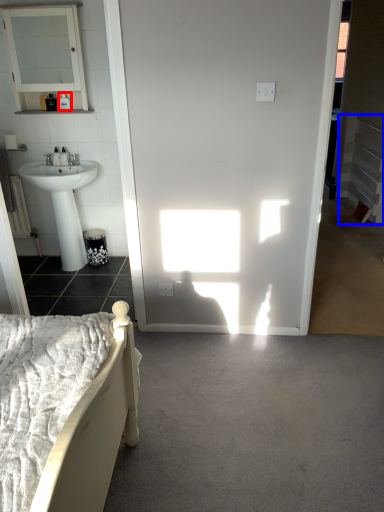
Question: Among these objects, which one is nearest to the camera, toiletry (highlighted by a red box) or balustrade (highlighted by a blue box)?

Choices:
 (A) toiletry
 (B) balustrade

Answer: (A)